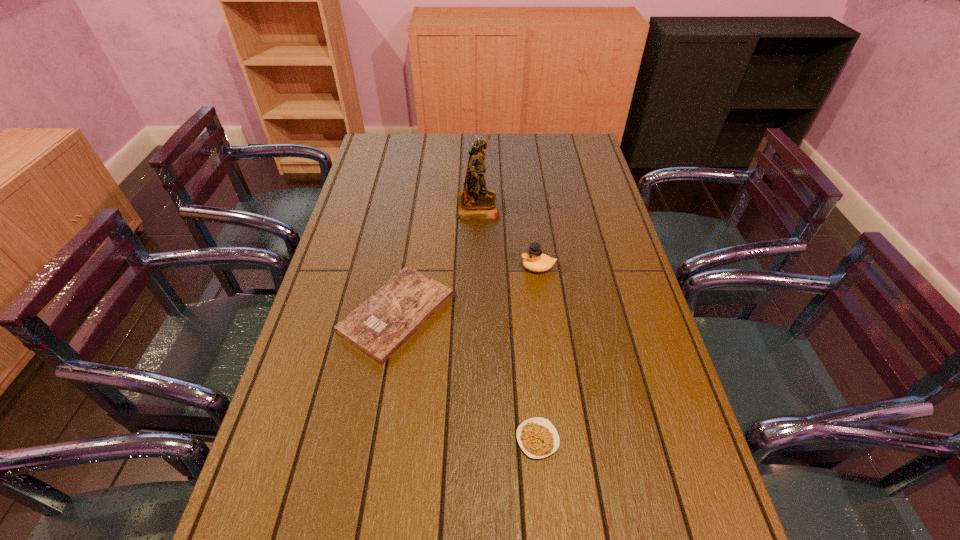
This screenshot has width=960, height=540. Identify the location of the farthest object. (475, 202).

Identify the location of figurine. The width and height of the screenshot is (960, 540). (475, 202).

I want to click on duck, so click(534, 260).

I want to click on Bible, so click(379, 326).

This screenshot has height=540, width=960. Identify the location of the shortest object. (538, 438).

Locate an element on the screen. The image size is (960, 540). legume is located at coordinates (538, 438).

The width and height of the screenshot is (960, 540). Identify the location of vacant space located 0.080m on the front-facing side of the farthest object. (522, 205).

Find the location of a particular element. The width and height of the screenshot is (960, 540). vacant space located 0.340m on the front-facing side of the third shortest object is located at coordinates (408, 267).

Locate an element on the screen. Image resolution: width=960 pixels, height=540 pixels. vacant space located on the front-facing side of the third shortest object is located at coordinates (415, 267).

Where is `free space located 0.330m on the front-facing side of the third shortest object`? The width and height of the screenshot is (960, 540). free space located 0.330m on the front-facing side of the third shortest object is located at coordinates (412, 267).